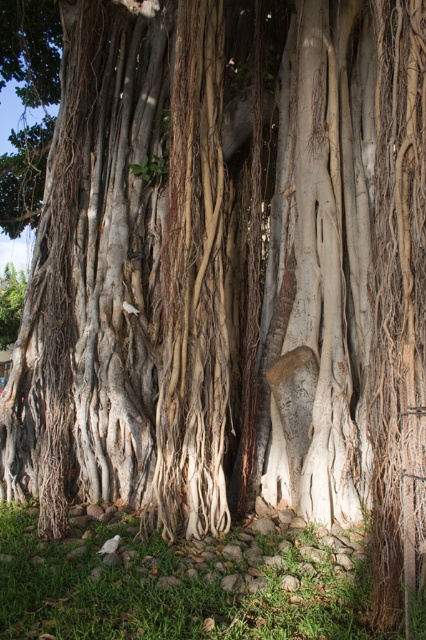
Between white textured bark at center and white rough bark at center, which one is positioned higher?

white textured bark at center is higher up.

You are a GUI agent. You are given a task and a screenshot of the screen. Output one action in this format:
    pyautogui.click(x=<x>, y=<y>)
    Task: Click on the white textured bark at center
    This screenshot has width=426, height=640.
    Given the screenshot: What is the action you would take?
    pyautogui.click(x=127, y=278)